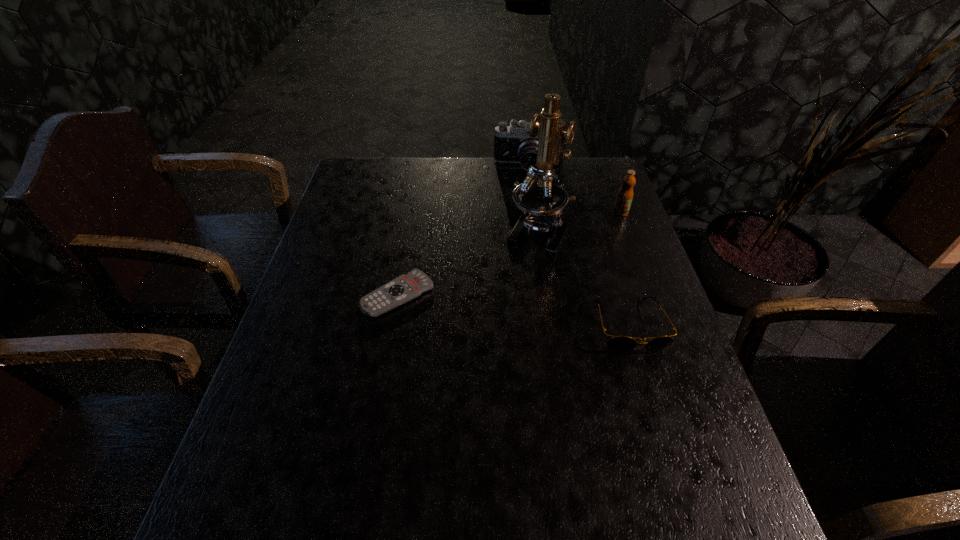
Find the location of a particular element. vacant space that satisfies the following two spatial constraints: 1. on the back side of the leftmost object; 2. on the left side of the orange juice is located at coordinates (413, 212).

Identify the location of vacant space that satisfies the following two spatial constraints: 1. on the front side of the orange juice; 2. on the left side of the camera. [535, 212].

The width and height of the screenshot is (960, 540). I want to click on blank space that satisfies the following two spatial constraints: 1. on the back side of the camera; 2. on the left side of the microscope, so click(527, 167).

The image size is (960, 540). Find the location of `free location that satisfies the following two spatial constraints: 1. on the back side of the orange juice; 2. on the right side of the leftmost object`. free location that satisfies the following two spatial constraints: 1. on the back side of the orange juice; 2. on the right side of the leftmost object is located at coordinates (413, 212).